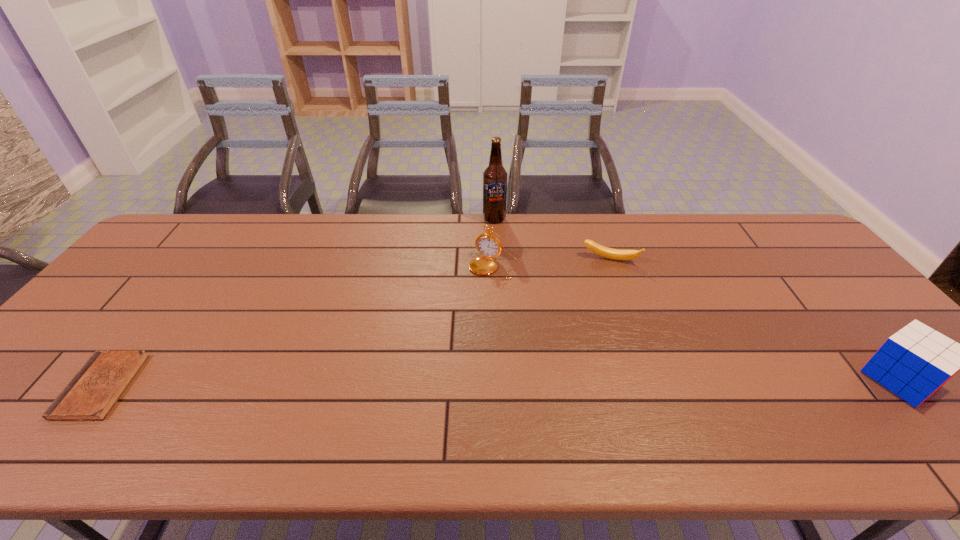
Find the location of a particular element. The image size is (960, 540). the shortest object is located at coordinates (91, 394).

This screenshot has width=960, height=540. Find the location of `the leftmost object`. the leftmost object is located at coordinates (91, 394).

Image resolution: width=960 pixels, height=540 pixels. I want to click on pocket watch, so click(488, 245).

This screenshot has width=960, height=540. Identify the location of beer bottle. (495, 176).

This screenshot has height=540, width=960. I want to click on the tallest object, so point(495,176).

The width and height of the screenshot is (960, 540). I want to click on the second shortest object, so click(x=615, y=254).

Locate an element on the screen. This screenshot has width=960, height=540. banana is located at coordinates (615, 254).

Where is `free region located 0.090m on the spine side of the shortest object`? Image resolution: width=960 pixels, height=540 pixels. free region located 0.090m on the spine side of the shortest object is located at coordinates (36, 387).

Identify the location of free space located on the spine side of the shortest object. This screenshot has height=540, width=960. (36, 387).

At what (x,y) coordinates should I click in order to perform the action: click on vacant space situated 0.150m on the face of the pocket watch. Please return your answer as a coordinate pair (x, y). The width and height of the screenshot is (960, 540). Looking at the image, I should click on (466, 313).